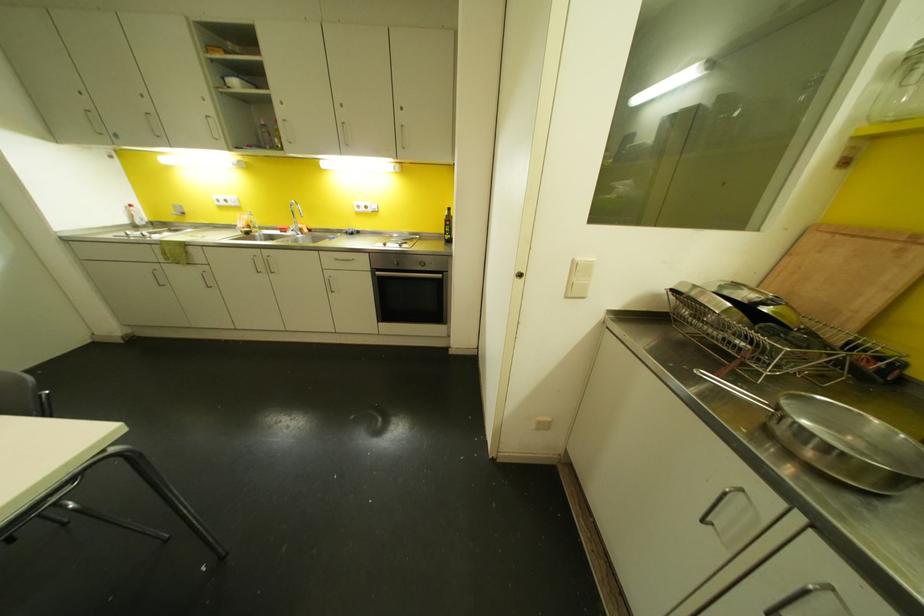
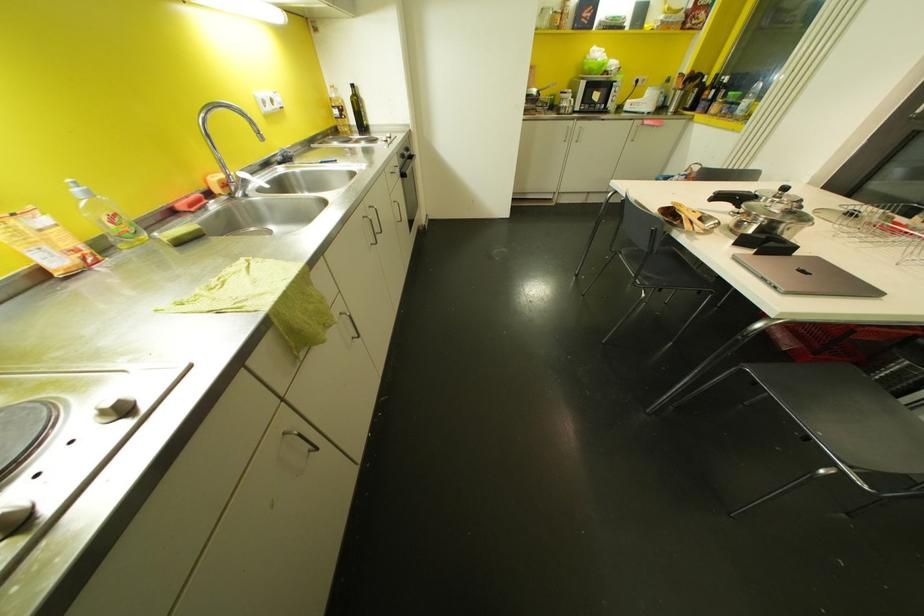
The point at (447, 209) is marked in the first image. Where is the corresponding point in the second image?

(353, 84)